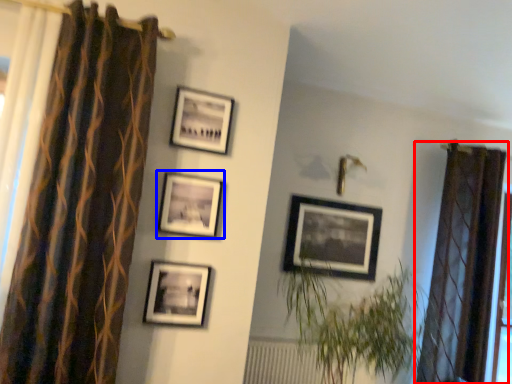
Question: Which object appears closest to the camera in this image, curtain (highlighted by a red box) or picture frame (highlighted by a blue box)?

Choices:
 (A) curtain
 (B) picture frame

Answer: (B)